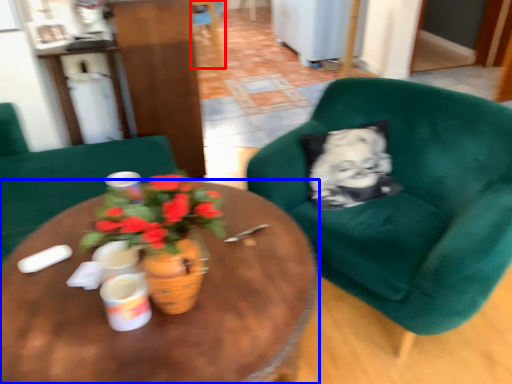
Question: Which object appears farthest to the camera in this image, chair (highlighted by a red box) or coffee table (highlighted by a blue box)?

Choices:
 (A) chair
 (B) coffee table

Answer: (A)